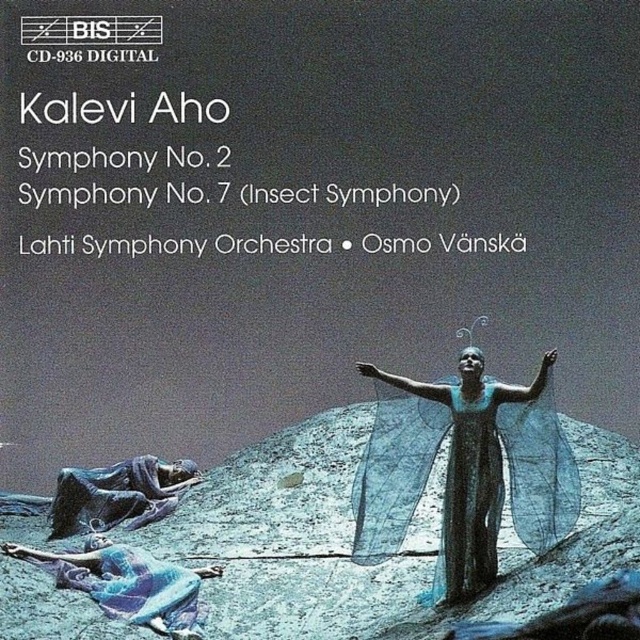
Can you confirm if translucent blue gown at center is positioned above matte black figure at lower left?

Indeed, translucent blue gown at center is positioned over matte black figure at lower left.

Where is `translucent blue gown at center`? The height and width of the screenshot is (640, 640). translucent blue gown at center is located at coordinates (454, 465).

Is point (380, 448) behind point (120, 464)?

No, it is in front of (120, 464).

Locate an element on the screen. translucent blue gown at center is located at coordinates (454, 465).

Does point (390, 518) come behind point (138, 573)?

No, (390, 518) is closer to viewer.

Can you confirm if translucent blue gown at center is positioned to the left of blue fabric at lower left?

In fact, translucent blue gown at center is to the right of blue fabric at lower left.

Where is `translucent blue gown at center`? The height and width of the screenshot is (640, 640). translucent blue gown at center is located at coordinates (454, 465).

Consider the image. Which of these two, blue fabric at lower left or matte black figure at lower left, stands shorter?

With less height is blue fabric at lower left.

Can you confirm if blue fabric at lower left is smaller than matte black figure at lower left?

No, blue fabric at lower left is not smaller than matte black figure at lower left.

You are a GUI agent. You are given a task and a screenshot of the screen. Output one action in this format:
    pyautogui.click(x=<x>, y=<y>)
    Task: Click on the blue fabric at lower left
    
    Given the screenshot: What is the action you would take?
    pyautogui.click(x=129, y=582)